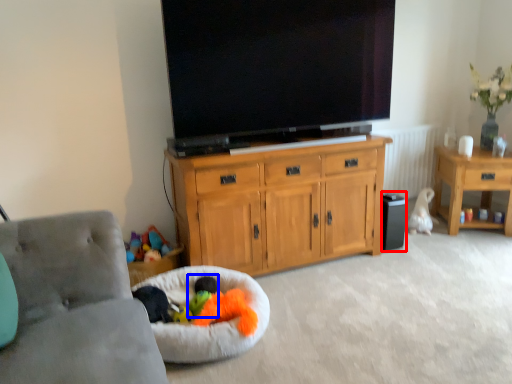
Question: Which object is further to the camera taking this photo, loudspeaker (highlighted by a red box) or toy (highlighted by a blue box)?

Choices:
 (A) loudspeaker
 (B) toy

Answer: (A)